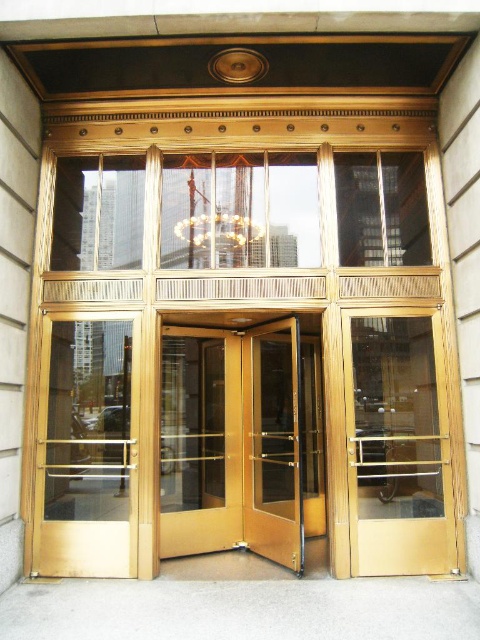
Describe the element at coordinates (242, 339) in the screenshot. I see `gold polished elevator at center` at that location.

Is point (336, 348) positioned behind point (411, 358)?

No, it is not.

Identify the location of gold polished elevator at center. Image resolution: width=480 pixels, height=640 pixels. (242, 339).

Looking at this image, between gold/glass door at center and clear glass door at right, which one is positioned lower?

gold/glass door at center is lower down.

Between gold/glass door at center and clear glass door at right, which one appears on the left side from the viewer's perspective?

gold/glass door at center is more to the left.

What are the coordinates of `gold/glass door at center` in the screenshot? It's located at (231, 444).

The width and height of the screenshot is (480, 640). In order to click on gold/glass door at center in this screenshot , I will do `click(231, 444)`.

Does gold polished elevator at center have a smaller size compared to gold polished door at center?

Incorrect, gold polished elevator at center is not smaller in size than gold polished door at center.

Between point (182, 179) and point (289, 557), which one is positioned in front?

Point (289, 557) is in front.

This screenshot has width=480, height=640. I want to click on gold polished elevator at center, so click(242, 339).